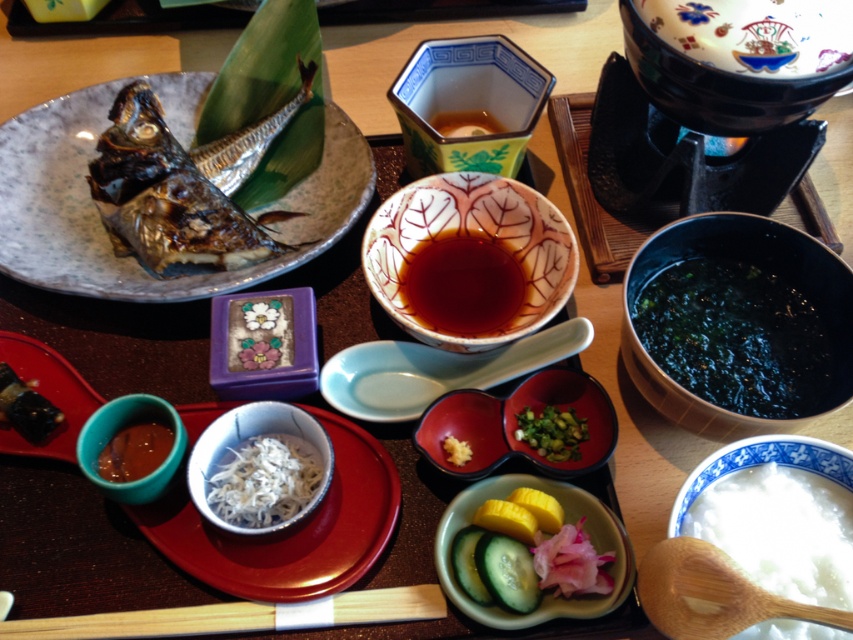
What do you see at coordinates (712, 593) in the screenshot? Image resolution: width=853 pixels, height=640 pixels. I see `wooden spoon at lower right` at bounding box center [712, 593].

Is point (699, 548) in front of point (273, 451)?

Yes.

Locate an element on the screen. wooden spoon at lower right is located at coordinates (712, 593).

Which is above, porcelain bowl at upper right or wooden chopsticks at lower center?

porcelain bowl at upper right is above.

Is point (688, 83) positioned in front of point (229, 604)?

No, it is not.

This screenshot has width=853, height=640. What are the coordinates of `porcelain bowl at upper right` in the screenshot? It's located at (729, 61).

Looking at this image, between slightly glossy brown sauce at lower left and slightly browned wood at lower left, which one is positioned higher?

slightly browned wood at lower left is higher up.

Between slightly glossy brown sauce at lower left and slightly browned wood at lower left, which one appears on the right side from the viewer's perspective?

slightly glossy brown sauce at lower left is more to the right.

Does point (134, 474) come closer to viewer compared to point (26, 420)?

Yes, point (134, 474) is in front of point (26, 420).

You are a GUI agent. You are given a task and a screenshot of the screen. Output one action in this format:
    pyautogui.click(x=<x>, y=<y>)
    Task: Click on the slightly glossy brown sauce at lower left
    The height and width of the screenshot is (640, 853).
    Given the screenshot: What is the action you would take?
    pyautogui.click(x=134, y=451)